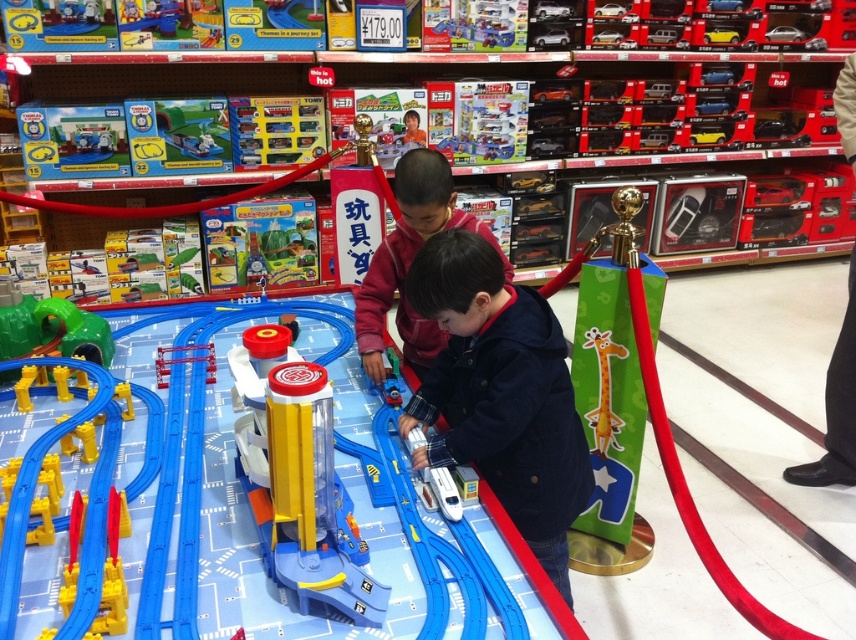
Question: Can you confirm if translucent plastic track at center is positioned to the left of red fleece jacket at center?

Choices:
 (A) no
 (B) yes

Answer: (B)

Question: Considering the real-world distances, which object is closest to the green plastic tunnel at lower left?

Choices:
 (A) dark blue jacket at center
 (B) red fleece jacket at center
 (C) translucent plastic track at center

Answer: (C)

Question: Does translucent plastic track at center lie in front of green plastic tunnel at lower left?

Choices:
 (A) no
 (B) yes

Answer: (B)

Question: Estimate the real-world distances between objects in this image. Which object is farther from the translucent plastic track at center?

Choices:
 (A) red fleece jacket at center
 (B) green plastic tunnel at lower left

Answer: (B)

Question: Which of the following is the farthest from the observer?

Choices:
 (A) green plastic tunnel at lower left
 (B) red fleece jacket at center
 (C) dark blue jacket at center

Answer: (A)

Question: In this image, where is translucent plastic track at center located relative to red fleece jacket at center?

Choices:
 (A) right
 (B) left

Answer: (B)